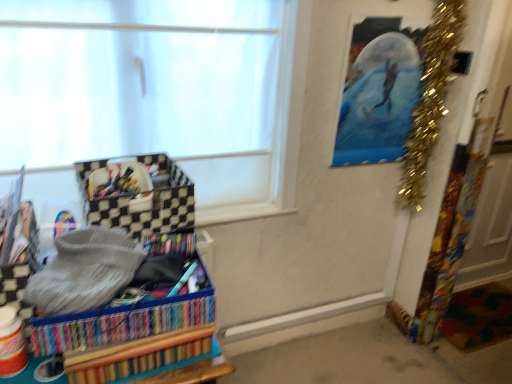
Question: Is black checkered storage box at left, the second storage box when ordered from bottom to top, oriented towards gold tinsel garland at upper right?

Choices:
 (A) yes
 (B) no

Answer: (B)

Question: Does black checkered storage box at left, which appears as the first storage box when viewed from the top, come in front of gold tinsel garland at upper right?

Choices:
 (A) yes
 (B) no

Answer: (A)

Question: Is black checkered storage box at left, the second storage box when ordered from bottom to top, behind gold tinsel garland at upper right?

Choices:
 (A) no
 (B) yes

Answer: (A)

Question: Is black checkered storage box at left, the second storage box when ordered from bottom to top, shorter than gold tinsel garland at upper right?

Choices:
 (A) yes
 (B) no

Answer: (A)

Question: Does black checkered storage box at left, which appears as the first storage box when viewed from the top, have a larger size compared to gold tinsel garland at upper right?

Choices:
 (A) no
 (B) yes

Answer: (A)

Question: From the image's perspective, would you say black checkered storage box at left, the second storage box when ordered from bottom to top, is shown under gold tinsel garland at upper right?

Choices:
 (A) no
 (B) yes

Answer: (B)

Question: Is the depth of gold tinsel garland at upper right greater than that of metallic blue painting at upper right?

Choices:
 (A) no
 (B) yes

Answer: (A)

Question: Is gold tinsel garland at upper right oriented away from metallic blue painting at upper right?

Choices:
 (A) yes
 (B) no

Answer: (A)

Question: Could you tell me if gold tinsel garland at upper right is facing metallic blue painting at upper right?

Choices:
 (A) no
 (B) yes

Answer: (A)

Question: Considering the relative sizes of gold tinsel garland at upper right and metallic blue painting at upper right in the image provided, is gold tinsel garland at upper right shorter than metallic blue painting at upper right?

Choices:
 (A) no
 (B) yes

Answer: (A)

Question: From a real-world perspective, does gold tinsel garland at upper right sit lower than metallic blue painting at upper right?

Choices:
 (A) no
 (B) yes

Answer: (B)

Question: Is gold tinsel garland at upper right positioned far away from metallic blue painting at upper right?

Choices:
 (A) yes
 (B) no

Answer: (B)

Question: Is metallic blue painting at upper right positioned in front of multicolored woven basket at lower left, placed as the second storage box when sorted from top to bottom?

Choices:
 (A) yes
 (B) no

Answer: (B)